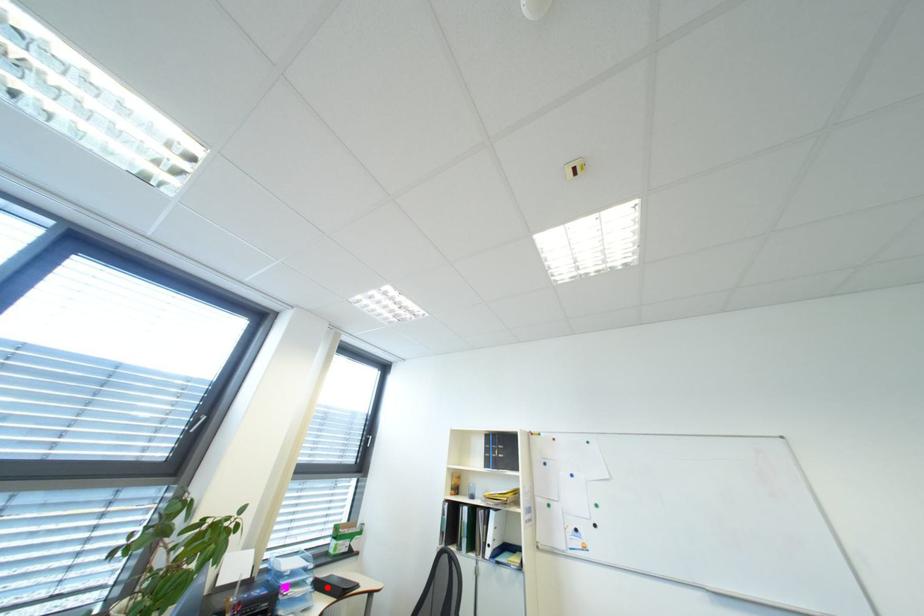
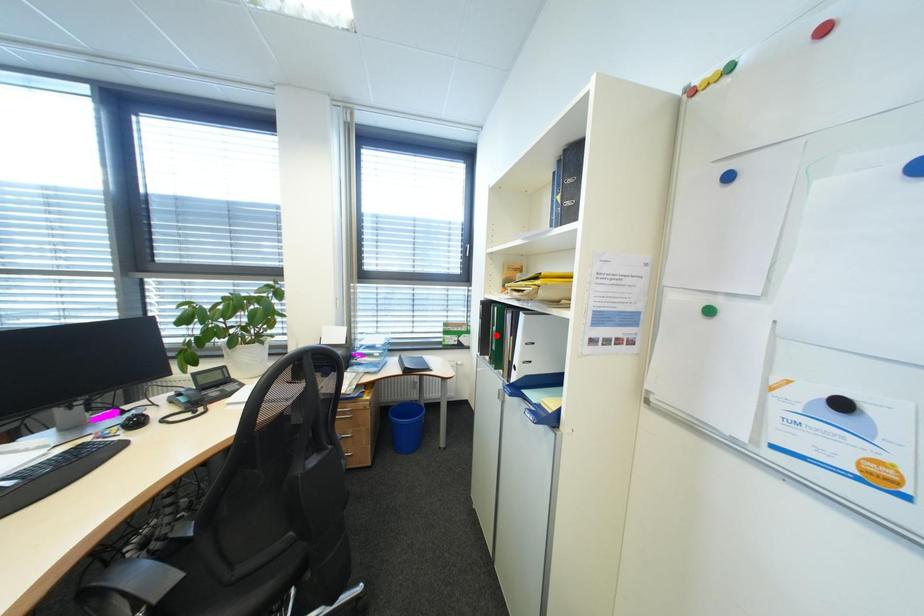
I am providing you with two images of the same scene from different viewpoints. A red point is marked on the first image and another point is marked on the second image. Is the red point in image1 aligned with the point shown in image2?

No